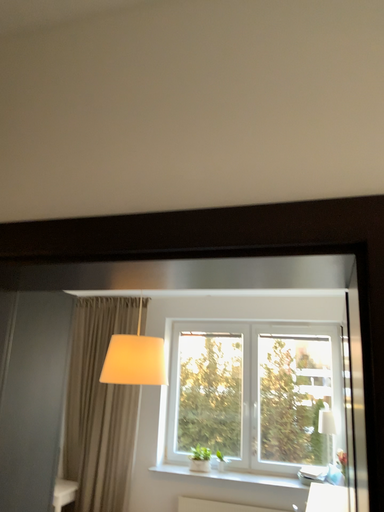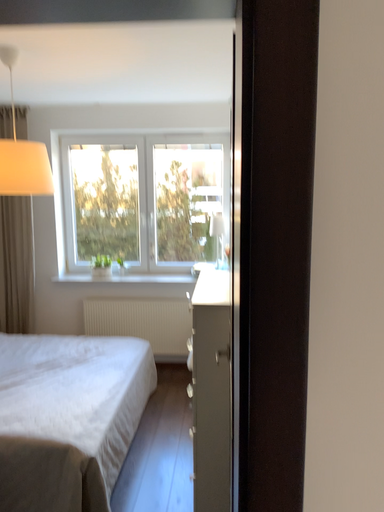
Question: How did the camera likely rotate when shooting the video?

Choices:
 (A) rotated right
 (B) rotated left

Answer: (A)